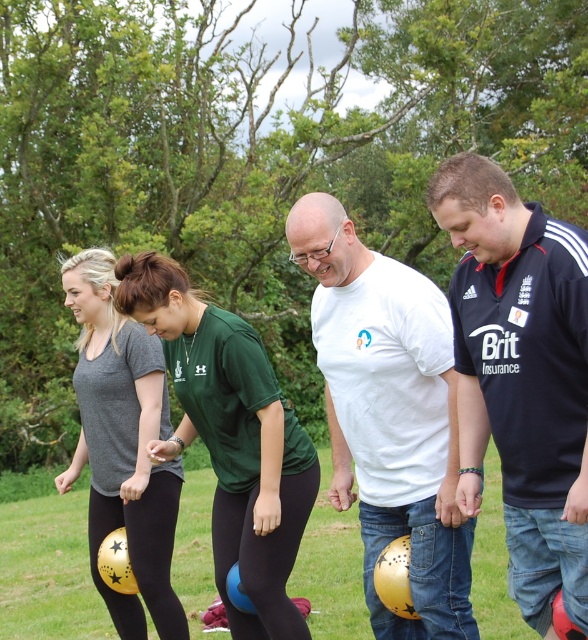
You are standing at the viewpoint of the image and want to walk towards the two points marked in the scene. Which point, point (584,298) or point (223,516), will you reach first?

You will reach point (584,298) first because it is closer to the viewer than point (223,516) according to the description.

You are organizing a team photo for a sports event and need to arrange the players based on their clothing. The dark blue jersey at center and the green matte shirt at center are two of the team members. Which clothing item should be placed on the left side if you want the wider one to be on the right?

The dark blue jersey at center occupies less space than green matte shirt at center, so the green matte shirt at center should be placed on the right side as it is wider, and the dark blue jersey at center on the left.